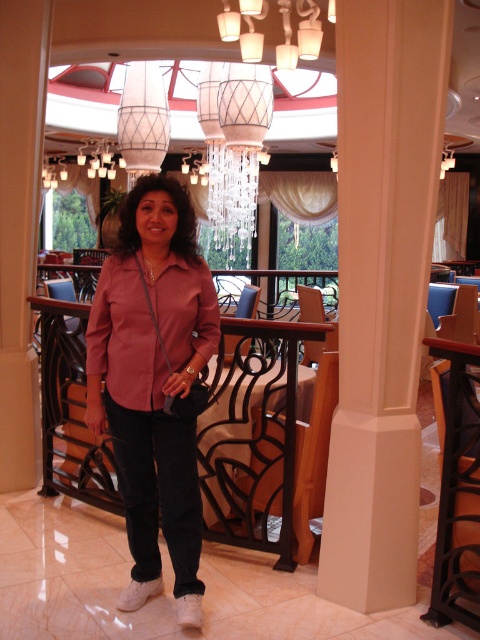
Between beige smooth column at center and pink satin blouse at center, which one has more height?

Standing taller between the two is beige smooth column at center.

Is point (360, 371) positioned behind point (168, 236)?

Yes, point (360, 371) is farther from viewer.

Measure the distance between point [382,444] and camera.

8.27 feet

You are a GUI agent. You are given a task and a screenshot of the screen. Output one action in this format:
    pyautogui.click(x=<x>, y=<y>)
    Task: Click on the beige smooth column at center
    This screenshot has height=640, width=480.
    Given the screenshot: What is the action you would take?
    pyautogui.click(x=382, y=291)

Does point (417, 157) come farther from viewer compared to point (313, 19)?

No, (417, 157) is closer to viewer.

Which is below, beige smooth column at center or matte glass chandelier at upper center?

beige smooth column at center is below.

Who is more distant from viewer, (343, 310) or (313, 49)?

The point (313, 49) is behind.

Find the location of a particular element. Image resolution: width=480 pixels, height=640 pixels. beige smooth column at center is located at coordinates (382, 291).

The width and height of the screenshot is (480, 640). I want to click on brown wrought iron at center, so click(x=253, y=435).

Does brown wrought iron at center have a lesser width compared to matte glass chandelier at upper center?

Yes.

This screenshot has height=640, width=480. Find the location of `brown wrought iron at center`. brown wrought iron at center is located at coordinates (253, 435).